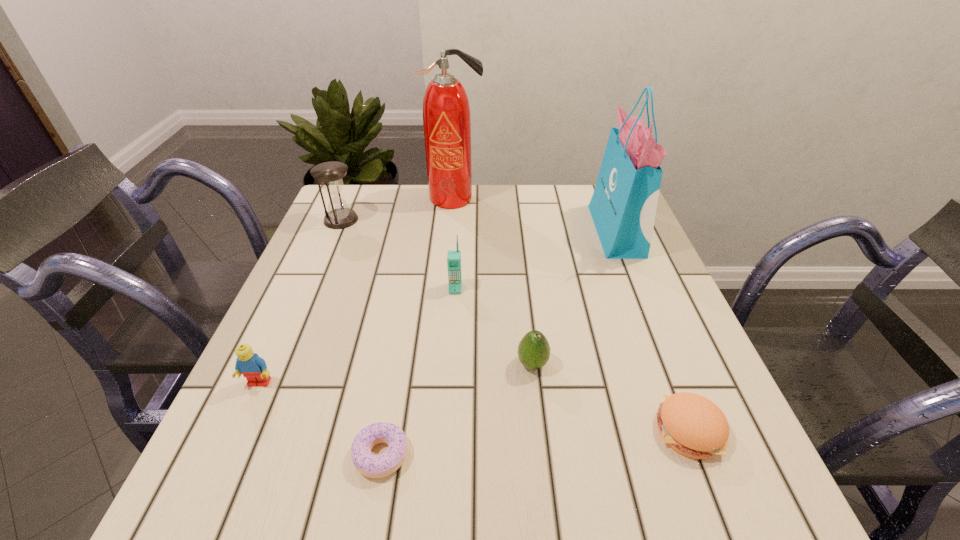
The height and width of the screenshot is (540, 960). I want to click on doughnut present at the near edge, so click(374, 466).

Locate an element on the screen. hourglass positioned at the left edge is located at coordinates click(x=330, y=174).

The width and height of the screenshot is (960, 540). What are the coordinates of `Lego that is at the left edge` in the screenshot? It's located at (254, 368).

What are the coordinates of `shopping bag at the right edge` in the screenshot? It's located at (623, 207).

Where is `patty located in the right edge section of the desktop`? The image size is (960, 540). patty located in the right edge section of the desktop is located at coordinates (692, 425).

Image resolution: width=960 pixels, height=540 pixels. In order to click on object positioned at the far left corner in this screenshot , I will do `click(330, 174)`.

Find the location of `object that is at the far right corner`. object that is at the far right corner is located at coordinates (623, 207).

Locate an element on the screen. This screenshot has width=960, height=540. object that is at the near right corner is located at coordinates (692, 425).

In the image, there is a desktop. What are the coordinates of `vacant space at the far edge` in the screenshot? It's located at (504, 218).

I want to click on vacant area at the near edge, so click(600, 460).